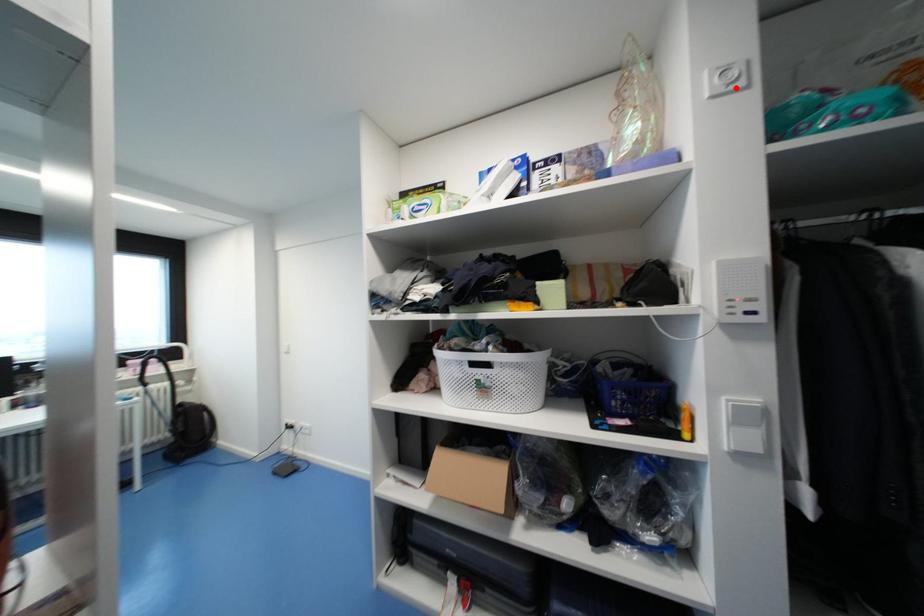
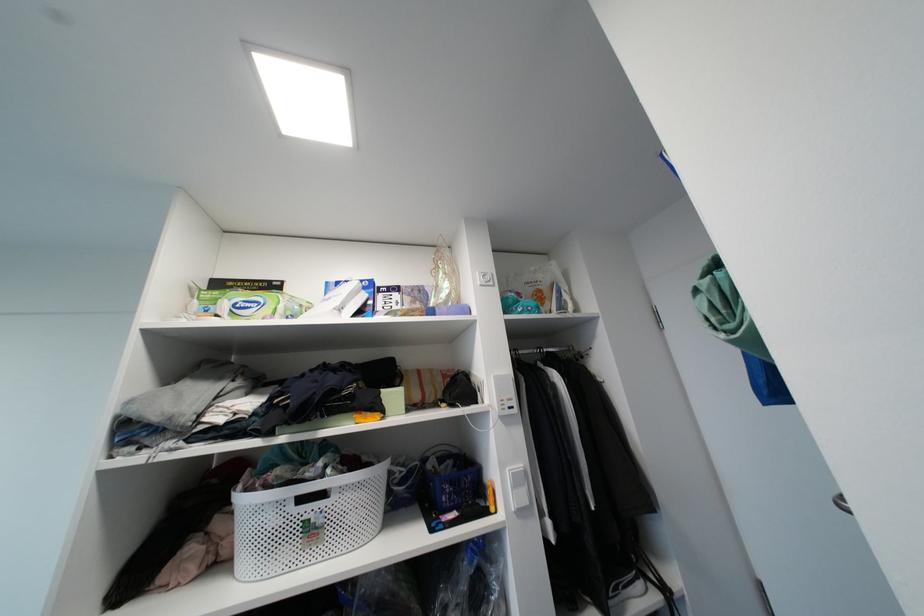
Find the pixel in the second image that matches the highlighted location in the first image.

(492, 284)